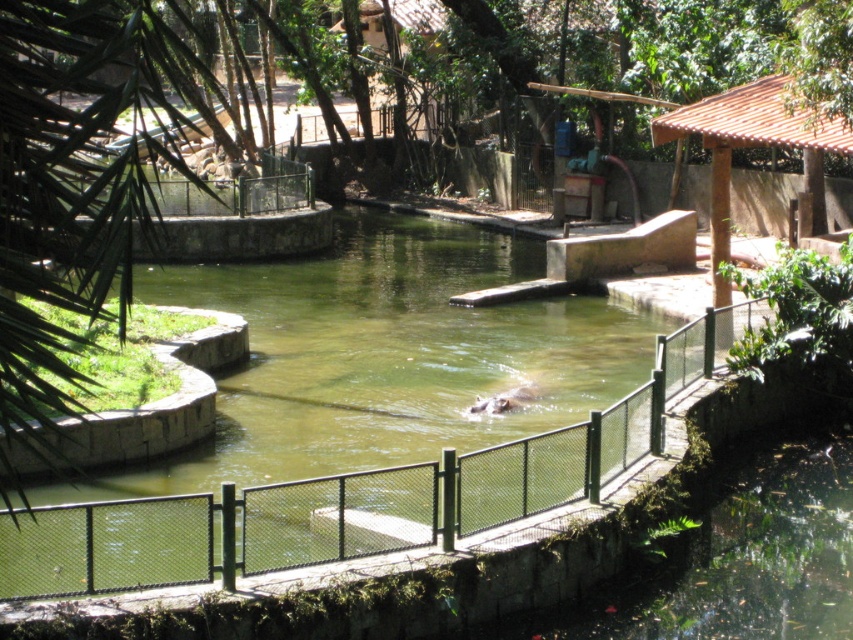
Question: Which object is closer to the camera taking this photo?

Choices:
 (A) brown tiled roof at upper right
 (B) gray matte hippo at center

Answer: (B)

Question: Which object appears farthest from the camera in this image?

Choices:
 (A) green mesh fence at center
 (B) gray matte hippo at center

Answer: (B)

Question: Which is farther from the green mesh fence at center?

Choices:
 (A) gray matte hippo at center
 (B) brown tiled roof at upper right

Answer: (B)

Question: Does brown tiled roof at upper right have a smaller size compared to gray matte hippo at center?

Choices:
 (A) yes
 (B) no

Answer: (B)

Question: Does green mesh fence at center have a greater width compared to gray matte hippo at center?

Choices:
 (A) yes
 (B) no

Answer: (A)

Question: Can you confirm if green mesh fence at center is positioned above gray matte hippo at center?

Choices:
 (A) yes
 (B) no

Answer: (B)